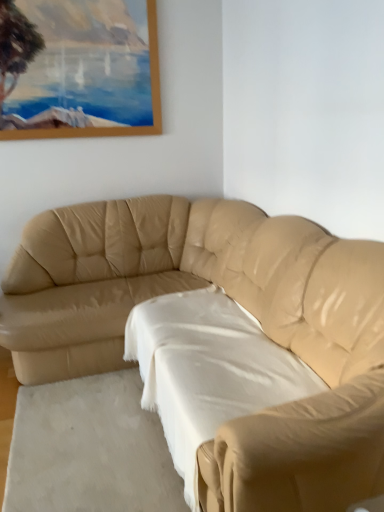
In order to face beige leather couch at center, should I rotate leftwards or rightwards?

You should look left and rotate roughly 5.495 degrees.

Describe the element at coordinates (240, 303) in the screenshot. I see `beige leather couch at center` at that location.

Find the location of `beige leather couch at center`. beige leather couch at center is located at coordinates (240, 303).

I want to click on beige leather couch at center, so click(x=240, y=303).